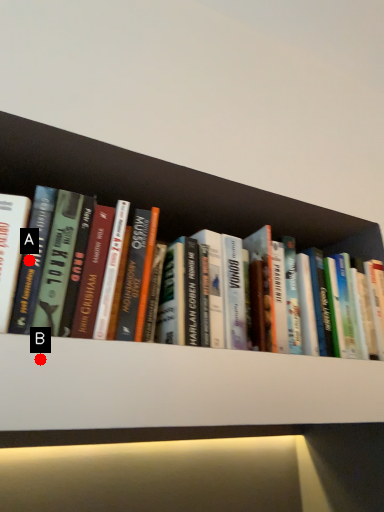
Question: Two points are circled on the image, labeled by A and B beside each circle. Which point is closer to the camera?

Choices:
 (A) A is closer
 (B) B is closer

Answer: (B)